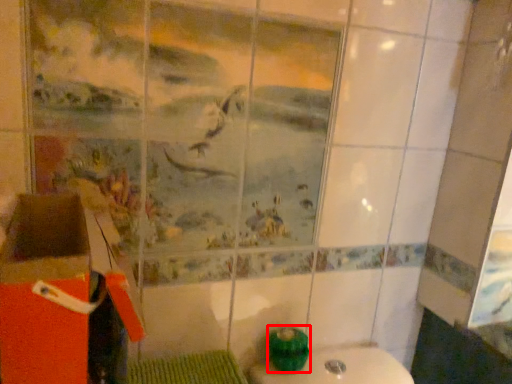
Question: Observing the image, what is the correct spatial positioning of teal (annotated by the red box) in reference to cardboard box?

Choices:
 (A) left
 (B) right

Answer: (B)